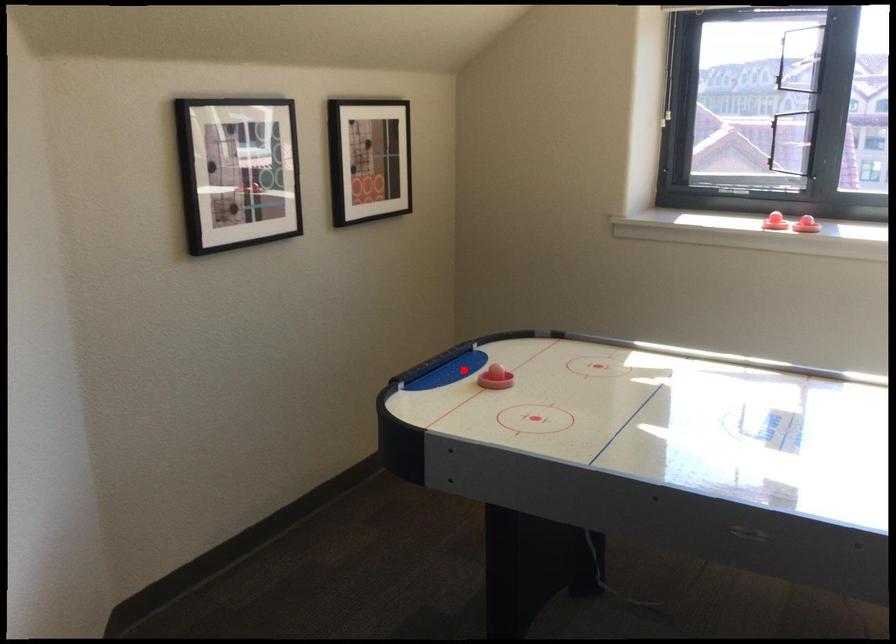
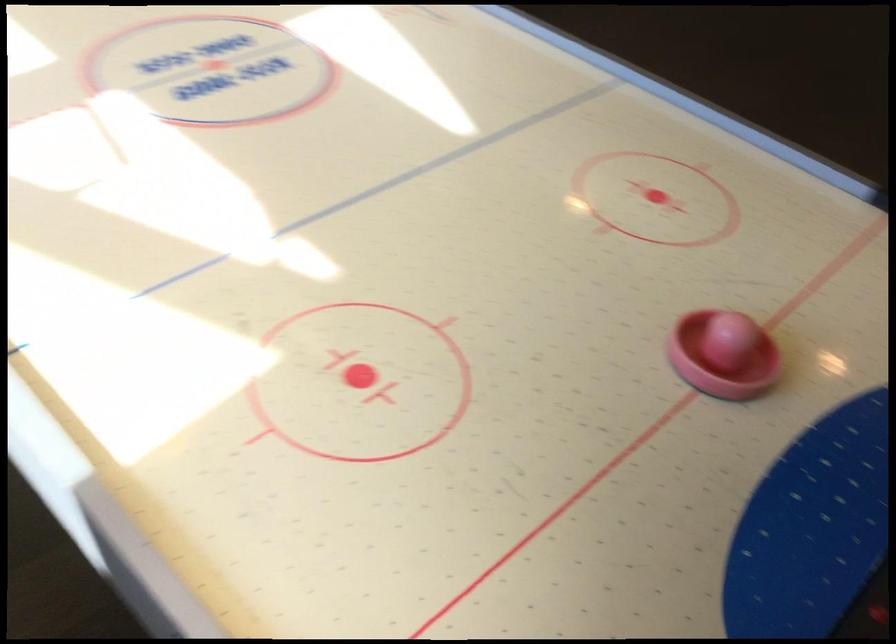
Locate, in the second image, the point that corresponds to the highlighted location in the first image.

(722, 355)